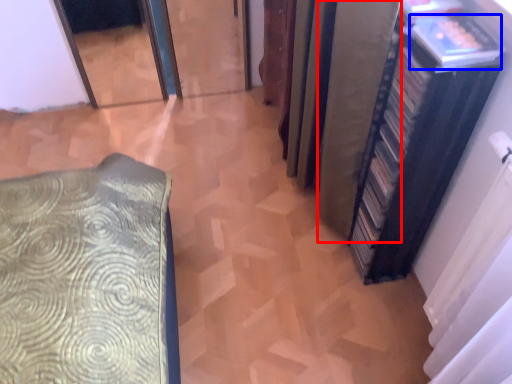
Question: Among these objects, which one is nearest to the camera, curtain (highlighted by a red box) or book (highlighted by a blue box)?

Choices:
 (A) curtain
 (B) book

Answer: (B)